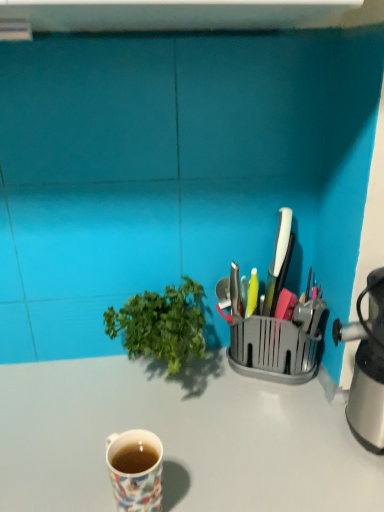
Question: Is metallic silver knife block at right placed right next to green leafy plant at center?

Choices:
 (A) no
 (B) yes

Answer: (A)

Question: Is metallic silver knife block at right to the left of green leafy plant at center from the viewer's perspective?

Choices:
 (A) no
 (B) yes

Answer: (A)

Question: From the image's perspective, would you say metallic silver knife block at right is shown under green leafy plant at center?

Choices:
 (A) yes
 (B) no

Answer: (B)

Question: Does metallic silver knife block at right have a greater width compared to green leafy plant at center?

Choices:
 (A) yes
 (B) no

Answer: (B)

Question: Is metallic silver knife block at right at the right side of green leafy plant at center?

Choices:
 (A) no
 (B) yes

Answer: (B)

Question: Is metallic silver knife block at right far away from green leafy plant at center?

Choices:
 (A) yes
 (B) no

Answer: (B)

Question: Considering the relative positions of white glossy desk at center and metallic silver knife block at right in the image provided, is white glossy desk at center to the right of metallic silver knife block at right from the viewer's perspective?

Choices:
 (A) no
 (B) yes

Answer: (A)

Question: Does white glossy desk at center have a greater height compared to metallic silver knife block at right?

Choices:
 (A) no
 (B) yes

Answer: (B)

Question: Is white glossy desk at center oriented away from metallic silver knife block at right?

Choices:
 (A) yes
 (B) no

Answer: (B)

Question: Considering the relative sizes of white glossy desk at center and metallic silver knife block at right in the image provided, is white glossy desk at center shorter than metallic silver knife block at right?

Choices:
 (A) no
 (B) yes

Answer: (A)

Question: Is white glossy desk at center surrounding metallic silver knife block at right?

Choices:
 (A) no
 (B) yes

Answer: (A)

Question: Does white glossy desk at center lie in front of metallic silver knife block at right?

Choices:
 (A) no
 (B) yes

Answer: (B)

Question: Is floral ceramic mug at lower left next to white glossy desk at center and touching it?

Choices:
 (A) no
 (B) yes

Answer: (A)